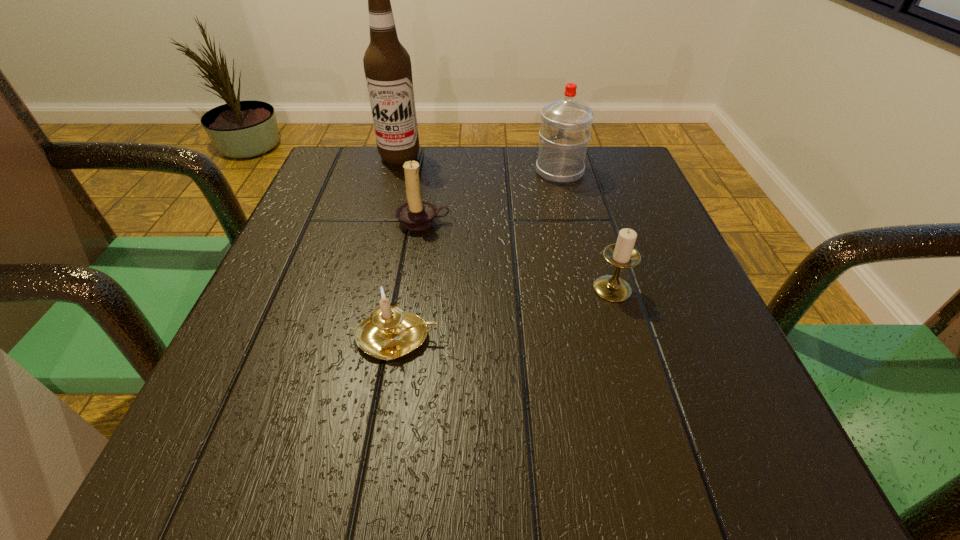
Image resolution: width=960 pixels, height=540 pixels. In order to click on free spot that satisfies the following two spatial constraints: 1. on the front side of the second farthest candle holder; 2. on the handle side of the nearest object in this screenshot , I will do `click(627, 338)`.